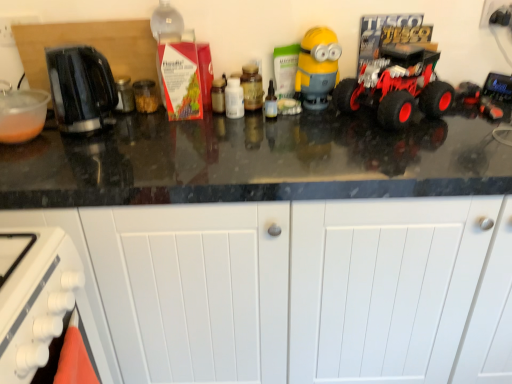
This screenshot has width=512, height=384. I want to click on free point in front of white plastic bottle at center, marked as the 1th bottle in a left-to-right arrangement, so click(x=223, y=136).